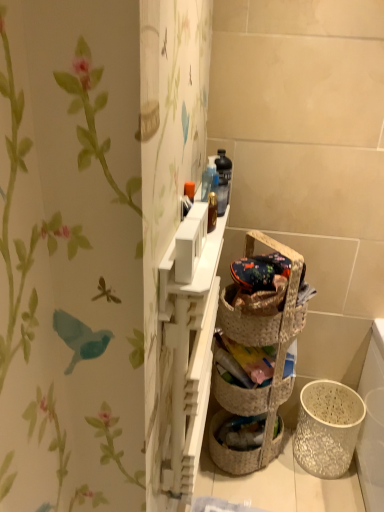
Question: Should I look upward or downward to see white matte cabinet at upper center?

Choices:
 (A) down
 (B) up

Answer: (A)

Question: From a real-world perspective, is woven straw basket at center, which is counted as the 2th basket container, starting from the right, located beneath white textured basket at lower right, the second basket container positioned from the left?

Choices:
 (A) yes
 (B) no

Answer: (B)

Question: From a real-world perspective, is woven straw basket at center, arranged as the second basket container when ordered from the bottom, over white textured basket at lower right, the second basket container positioned from the left?

Choices:
 (A) no
 (B) yes

Answer: (B)

Question: Is woven straw basket at center, arranged as the second basket container when ordered from the bottom, taller than white textured basket at lower right, positioned as the 2th basket container in top-to-bottom order?

Choices:
 (A) no
 (B) yes

Answer: (A)

Question: Is woven straw basket at center, which is counted as the 2th basket container, starting from the right, at the right side of white textured basket at lower right, the second basket container positioned from the left?

Choices:
 (A) no
 (B) yes

Answer: (A)

Question: Considering the relative sizes of woven straw basket at center, which is counted as the 2th basket container, starting from the right, and white textured basket at lower right, which ranks as the first basket container in bottom-to-top order, in the image provided, is woven straw basket at center, which is counted as the 2th basket container, starting from the right, bigger than white textured basket at lower right, which ranks as the first basket container in bottom-to-top order,?

Choices:
 (A) yes
 (B) no

Answer: (B)

Question: Is woven straw basket at center, placed as the 1th basket container when sorted from top to bottom, oriented towards white textured basket at lower right, the 1th basket container from the right?

Choices:
 (A) no
 (B) yes

Answer: (A)

Question: Is white textured basket at lower right, positioned as the 2th basket container in top-to-bottom order, shorter than woven straw basket at center, which is counted as the 2th basket container, starting from the right?

Choices:
 (A) no
 (B) yes

Answer: (A)

Question: Is white textured basket at lower right, which ranks as the first basket container in bottom-to-top order, positioned before woven straw basket at center, which is counted as the 2th basket container, starting from the right?

Choices:
 (A) yes
 (B) no

Answer: (B)

Question: Considering the relative positions of white textured basket at lower right, the 1th basket container from the right, and woven straw basket at center, positioned as the first basket container in left-to-right order, in the image provided, is white textured basket at lower right, the 1th basket container from the right, behind woven straw basket at center, positioned as the first basket container in left-to-right order,?

Choices:
 (A) no
 (B) yes

Answer: (B)

Question: Could you tell me if white textured basket at lower right, which ranks as the first basket container in bottom-to-top order, is turned towards woven straw basket at center, placed as the 1th basket container when sorted from top to bottom?

Choices:
 (A) no
 (B) yes

Answer: (A)

Question: Does white textured basket at lower right, the 1th basket container from the right, have a lesser width compared to woven straw basket at center, arranged as the second basket container when ordered from the bottom?

Choices:
 (A) yes
 (B) no

Answer: (B)

Question: From a real-world perspective, is white textured basket at lower right, positioned as the 2th basket container in top-to-bottom order, below woven straw basket at center, placed as the 1th basket container when sorted from top to bottom?

Choices:
 (A) yes
 (B) no

Answer: (A)

Question: Considering the relative positions of woven brown picnic basket at center and white textured basket at lower right, which ranks as the first basket container in bottom-to-top order, in the image provided, is woven brown picnic basket at center to the right of white textured basket at lower right, which ranks as the first basket container in bottom-to-top order, from the viewer's perspective?

Choices:
 (A) no
 (B) yes

Answer: (A)